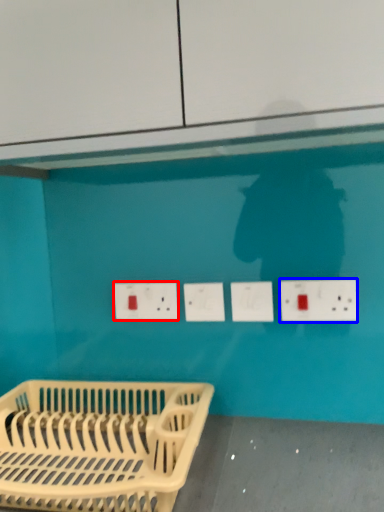
Question: Which object appears farthest to the camera in this image, electric outlet (highlighted by a red box) or electric outlet (highlighted by a blue box)?

Choices:
 (A) electric outlet
 (B) electric outlet

Answer: (A)